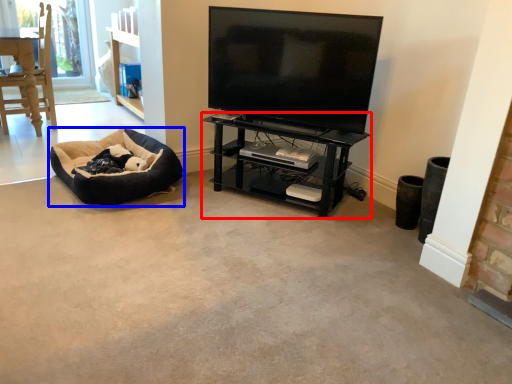
Question: Which object is further to the camera taking this photo, shelf (highlighted by a red box) or dog bed (highlighted by a blue box)?

Choices:
 (A) shelf
 (B) dog bed

Answer: (B)